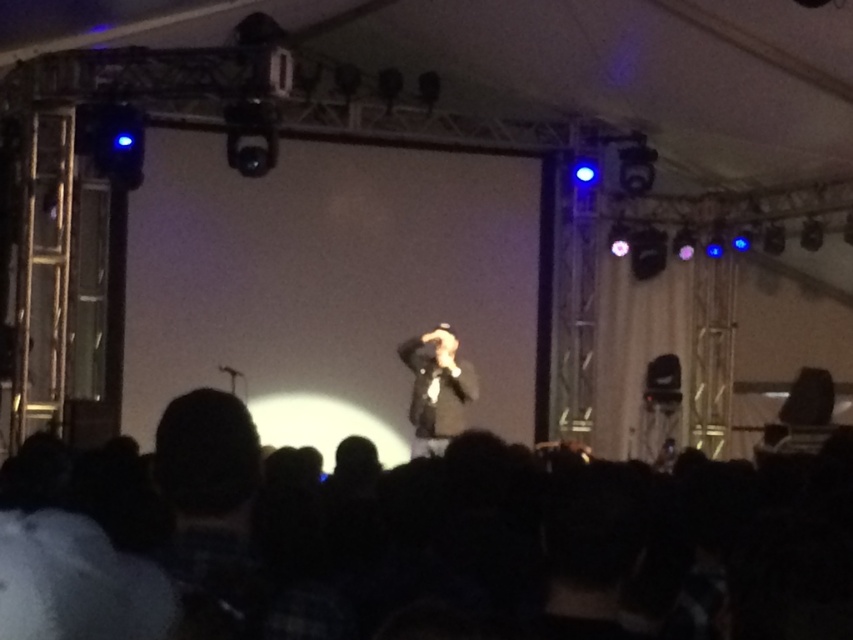
Question: Considering the relative positions of black fabric at lower center and dark suit at center in the image provided, where is black fabric at lower center located with respect to dark suit at center?

Choices:
 (A) below
 (B) above

Answer: (A)

Question: Is black fabric at lower center to the left of dark suit at center from the viewer's perspective?

Choices:
 (A) yes
 (B) no

Answer: (A)

Question: Among these objects, which one is nearest to the camera?

Choices:
 (A) dark suit at center
 (B) black fabric at lower center

Answer: (B)

Question: Among these points, which one is nearest to the camera?

Choices:
 (A) (349, 564)
 (B) (415, 362)

Answer: (A)

Question: Is black fabric at lower center positioned behind dark suit at center?

Choices:
 (A) no
 (B) yes

Answer: (A)